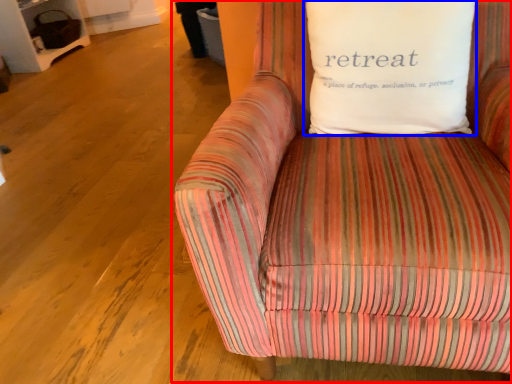
Question: Which of the following is the closest to the observer, studio couch (highlighted by a red box) or pillow (highlighted by a blue box)?

Choices:
 (A) studio couch
 (B) pillow

Answer: (A)